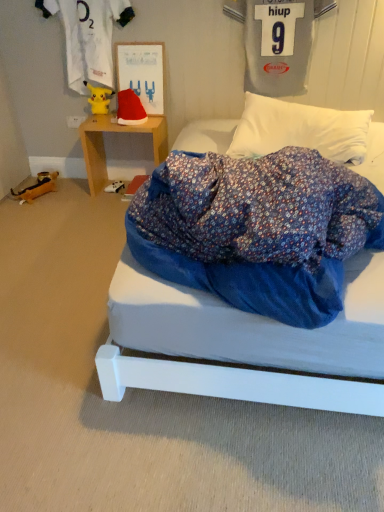
Question: Does fluffy white pillow at upper center have a greater height compared to gray jersey at upper right, the 1th clothing positioned from the right?

Choices:
 (A) yes
 (B) no

Answer: (B)

Question: Does fluffy white pillow at upper center touch gray jersey at upper right, positioned as the second clothing in left-to-right order?

Choices:
 (A) yes
 (B) no

Answer: (B)

Question: Is fluffy white pillow at upper center turned away from gray jersey at upper right, positioned as the second clothing in left-to-right order?

Choices:
 (A) yes
 (B) no

Answer: (B)

Question: From a real-world perspective, does fluffy white pillow at upper center stand above gray jersey at upper right, the 1th clothing positioned from the right?

Choices:
 (A) no
 (B) yes

Answer: (A)

Question: Is fluffy white pillow at upper center positioned in front of gray jersey at upper right, positioned as the second clothing in left-to-right order?

Choices:
 (A) no
 (B) yes

Answer: (B)

Question: Looking at the image, does matte paperboard at upper center seem bigger or smaller compared to wooden table at left?

Choices:
 (A) big
 (B) small

Answer: (B)

Question: Is matte paperboard at upper center in front of or behind wooden table at left in the image?

Choices:
 (A) front
 (B) behind

Answer: (A)

Question: From a real-world perspective, is matte paperboard at upper center above or below wooden table at left?

Choices:
 (A) below
 (B) above

Answer: (B)

Question: From their relative heights in the image, would you say matte paperboard at upper center is taller or shorter than wooden table at left?

Choices:
 (A) short
 (B) tall

Answer: (A)

Question: Is yellow plush toy at upper left, which appears as the first clothing when viewed from the left, inside the boundaries of wooden toy at left, the second toy when ordered from top to bottom, or outside?

Choices:
 (A) outside
 (B) inside

Answer: (A)

Question: From the image's perspective, relative to wooden toy at left, the second toy when ordered from top to bottom, is yellow plush toy at upper left, which is counted as the second clothing, starting from the right, above or below?

Choices:
 (A) below
 (B) above

Answer: (B)

Question: Relative to wooden toy at left, which is the first toy in left-to-right order, is yellow plush toy at upper left, which appears as the first clothing when viewed from the left, in front or behind?

Choices:
 (A) front
 (B) behind

Answer: (A)

Question: Considering the positions of yellow plush toy at upper left, which is counted as the second clothing, starting from the right, and wooden toy at left, the second toy when ordered from top to bottom, in the image, is yellow plush toy at upper left, which is counted as the second clothing, starting from the right, bigger or smaller than wooden toy at left, the second toy when ordered from top to bottom,?

Choices:
 (A) small
 (B) big

Answer: (B)

Question: Is point (354, 156) closer or farther from the camera than point (44, 175)?

Choices:
 (A) farther
 (B) closer

Answer: (B)

Question: Based on their positions, is fluffy white pillow at upper center located to the left or right of wooden toy at left, the 1th toy from the bottom?

Choices:
 (A) left
 (B) right

Answer: (B)